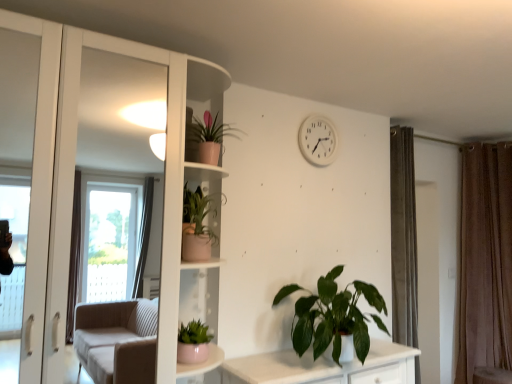
Question: Relative to matte pink pot at center-left, the 3th houseplant in the right-to-left sequence, is matte pink pot at lower center, the 3th houseplant from the top, in front or behind?

Choices:
 (A) behind
 (B) front

Answer: (B)

Question: Is matte pink pot at lower center, the 3th houseplant from the top, wider or thinner than matte pink pot at center-left, the third houseplant positioned from the bottom?

Choices:
 (A) wide
 (B) thin

Answer: (B)

Question: Which of these objects is positioned closest to the green matte plant at lower center, the 1th houseplant from the bottom?

Choices:
 (A) matte pink pot at lower center, which is counted as the 1th houseplant, starting from the left
 (B) white plastic clock at upper center
 (C) matte pink pot at center-left, the second houseplant viewed from the top
 (D) pink matte pot at upper center, the first houseplant viewed from the top
 (E) brown velvet curtain at right

Answer: (A)

Question: Which object is positioned closest to the pink matte pot at upper center, which is the fourth houseplant from bottom to top?

Choices:
 (A) white plastic clock at upper center
 (B) matte pink pot at center-left, the 3th houseplant in the right-to-left sequence
 (C) brown velvet curtain at right
 (D) green matte plant at lower center, acting as the 4th houseplant starting from the top
 (E) matte pink pot at lower center, placed as the 4th houseplant when sorted from right to left

Answer: (B)